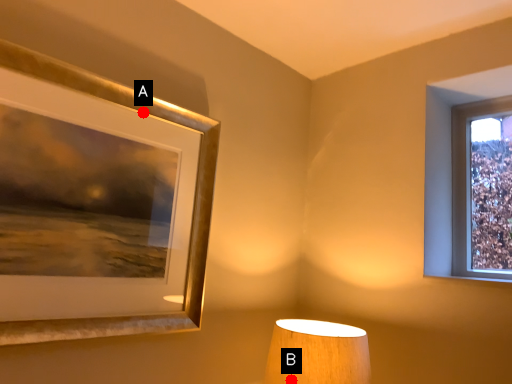
Question: Two points are circled on the image, labeled by A and B beside each circle. Which point is closer to the camera taking this photo?

Choices:
 (A) A is closer
 (B) B is closer

Answer: (B)